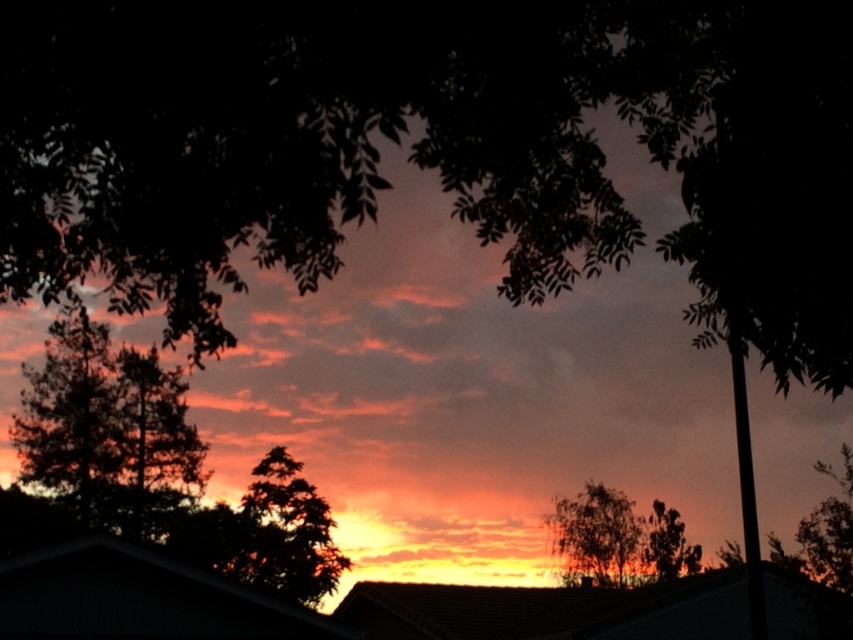
You are standing in the middle of a path that leads to the sunset scene. You see the green textured tree at left and the green leafy tree at center. Which tree is closer to your right side?

The green leafy tree at center is closer to your right side because it is positioned to the right of the green textured tree at left.

You are an observer standing in front of the sunset scene. You notice two trees, the dark green leafy tree at left and the green leafy tree at center. Which tree appears closer to you?

The dark green leafy tree at left appears closer because it is positioned over the green leafy tree at center, indicating it is in front.